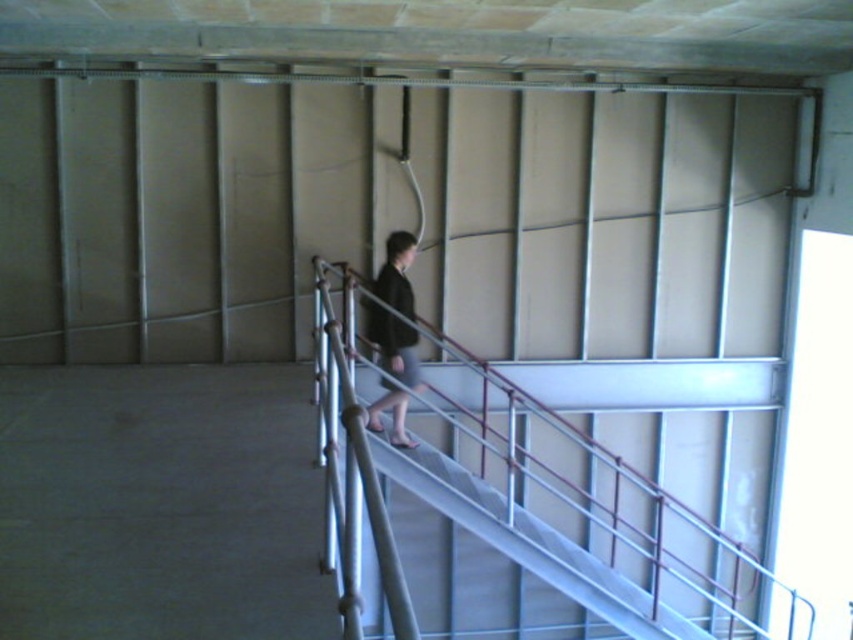
Question: Is metallic silver handrail at center above dark gray fabric dress at center?

Choices:
 (A) yes
 (B) no

Answer: (B)

Question: Which point is closer to the camera taking this photo?

Choices:
 (A) (708, 557)
 (B) (403, 292)

Answer: (B)

Question: Which point appears closest to the camera in this image?

Choices:
 (A) (529, 461)
 (B) (402, 380)

Answer: (B)

Question: Does metallic silver handrail at center have a larger size compared to dark gray fabric dress at center?

Choices:
 (A) yes
 (B) no

Answer: (A)

Question: Is metallic silver handrail at center closer to the viewer compared to dark gray fabric dress at center?

Choices:
 (A) yes
 (B) no

Answer: (B)